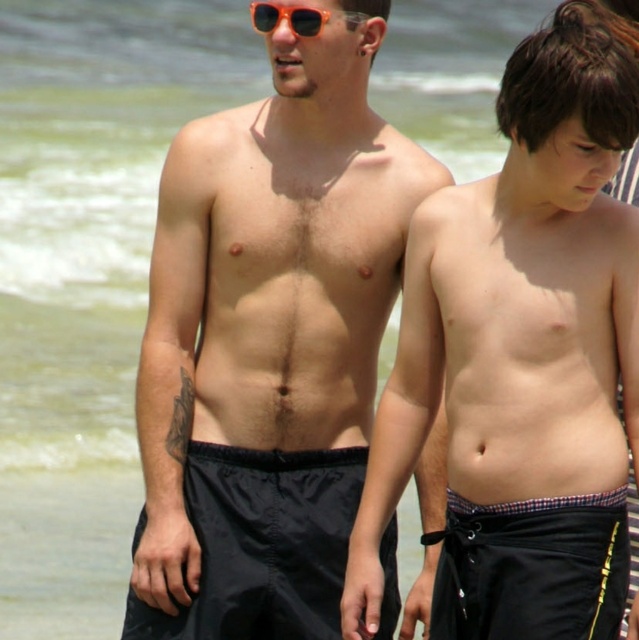
Question: Does matte black shorts at center have a smaller size compared to orange plastic sunglasses at upper center?

Choices:
 (A) no
 (B) yes

Answer: (B)

Question: Does black nylon shorts at center appear under plaid fabric shorts at lower center?

Choices:
 (A) no
 (B) yes

Answer: (A)

Question: Among these points, which one is nearest to the camera?

Choices:
 (A) (613, 243)
 (B) (599, 516)
 (C) (311, 17)

Answer: (B)

Question: Which point is farther to the camera?

Choices:
 (A) orange plastic sunglasses at upper center
 (B) plaid fabric shorts at lower center
 (C) smooth skin torso at center

Answer: (A)

Question: Does black nylon shorts at center have a greater width compared to plaid fabric shorts at lower center?

Choices:
 (A) yes
 (B) no

Answer: (A)

Question: Which of the following is the closest to the observer?

Choices:
 (A) (601, 592)
 (B) (528, 308)

Answer: (A)